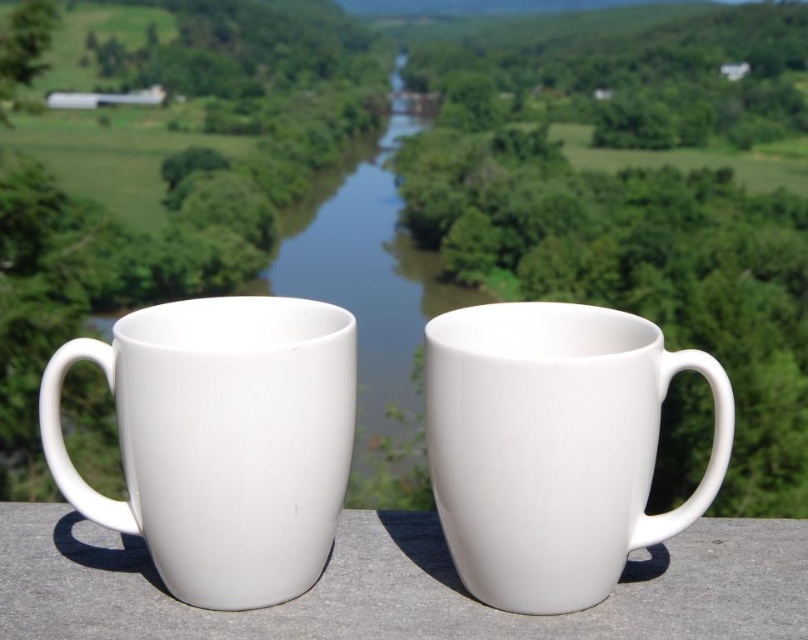
Who is positioned more to the left, white glossy mug at left or glossy water at center?

white glossy mug at left

Is white glossy mug at left below glossy water at center?

Yes, white glossy mug at left is below glossy water at center.

Between point (242, 499) and point (386, 205), which one is positioned in front?

Point (242, 499) is more forward.

Find the location of a particular element. This screenshot has width=808, height=640. white glossy mug at left is located at coordinates 221,440.

Is white glossy mug at left bigger than white matte ledge at center?

Actually, white glossy mug at left might be smaller than white matte ledge at center.

Between white glossy mug at left and white matte ledge at center, which one has more height?

Standing taller between the two is white glossy mug at left.

Who is more forward, [131,368] or [337,618]?

Point [131,368] is more forward.

Find the location of a particular element. The image size is (808, 640). white glossy mug at left is located at coordinates (221, 440).

Can you confirm if white matte ledge at center is positioned below glossy water at center?

Yes.

Is point (289, 634) positioned in front of point (373, 429)?

Yes, it is.

What are the coordinates of `white matte ledge at center` in the screenshot? It's located at (398, 588).